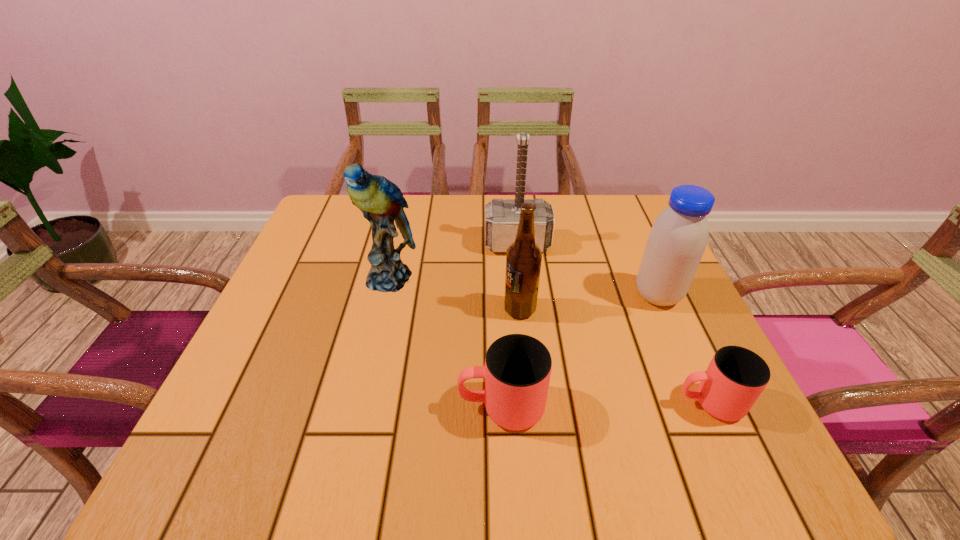
Locate an element on the screen. vacant space located on the handle side of the left cup is located at coordinates (247, 407).

This screenshot has width=960, height=540. Identify the location of free point located 0.200m on the handle side of the shortest object. (562, 403).

I want to click on free space located 0.070m on the handle side of the shortest object, so click(x=636, y=403).

This screenshot has width=960, height=540. Find the location of `free spot located 0.350m on the handle side of the shortest object`. free spot located 0.350m on the handle side of the shortest object is located at coordinates (476, 403).

The height and width of the screenshot is (540, 960). I want to click on free space located on the back of the soya milk, so click(x=638, y=251).

Image resolution: width=960 pixels, height=540 pixels. I want to click on free location located on the face of the parrot, so click(376, 334).

Identify the location of vacant area situated for striking with the head of the farthest object. The height and width of the screenshot is (540, 960). pos(525,321).

Where is `vacant area situated on the label of the beer bottle`? This screenshot has height=540, width=960. vacant area situated on the label of the beer bottle is located at coordinates (323, 309).

Find the location of a particular element. free point located 0.280m on the label of the beer bottle is located at coordinates (374, 309).

The image size is (960, 540). I want to click on free space located 0.200m on the label of the beer bottle, so click(x=411, y=309).